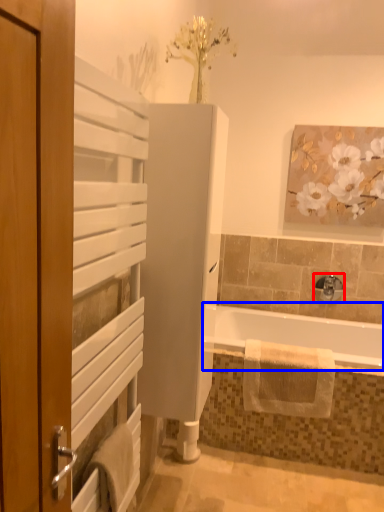
Question: Which point is further to the camera, tap (highlighted by a red box) or bathtub (highlighted by a blue box)?

Choices:
 (A) tap
 (B) bathtub

Answer: (A)